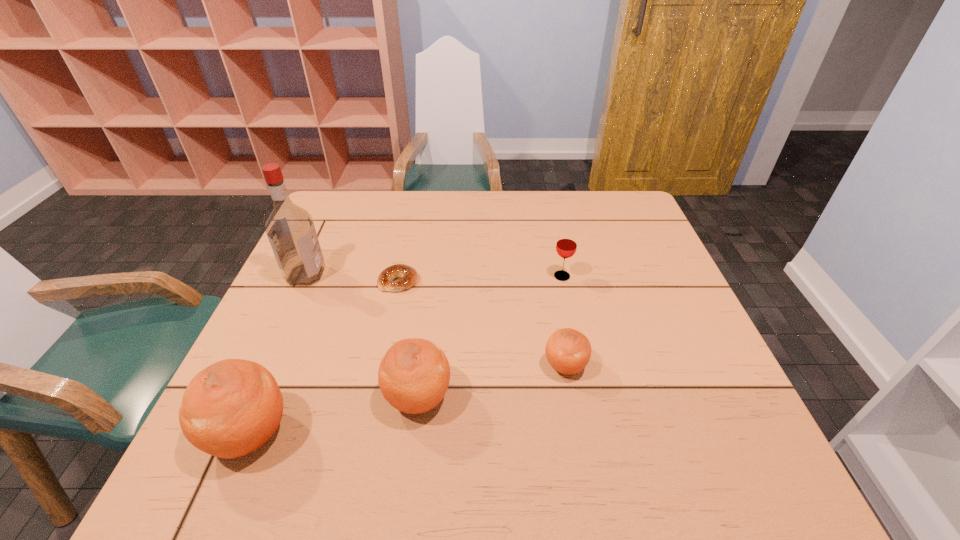
Please show where to add a orange on the right while keeping spacing even. Please provide its 2D coordinates. Your answer should be formatted as a tuple, i.e. [(x, y)], where the tuple contains the x and y coordinates of a point satisfying the conditions above.

[(695, 338)]